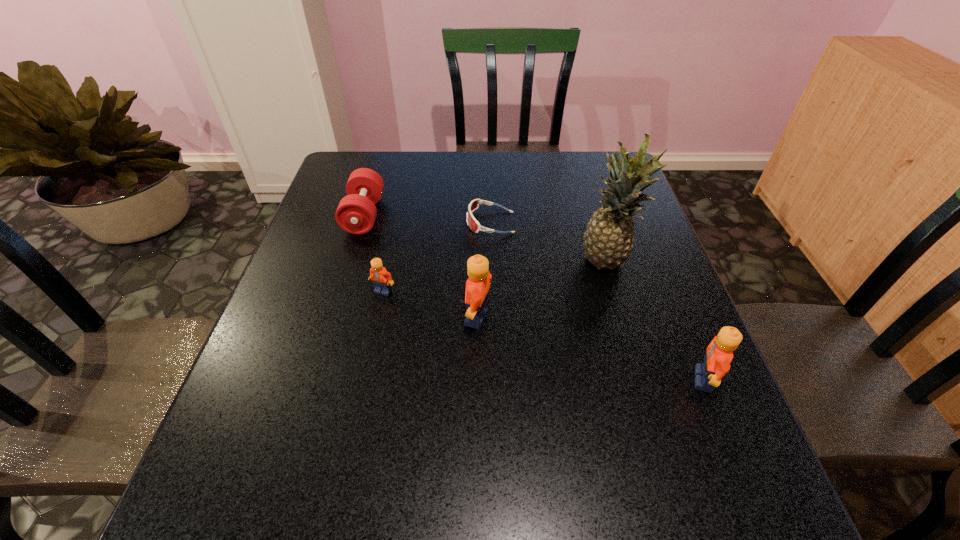
Where is `free point between the fourth farthest object and the rightmost Lego`? The width and height of the screenshot is (960, 540). free point between the fourth farthest object and the rightmost Lego is located at coordinates (543, 335).

This screenshot has height=540, width=960. Identify the location of vacant space in between the leftmost object and the fifth object from left to right. (486, 238).

Find the location of a particular element. The height and width of the screenshot is (540, 960). vacant point located between the second object from right to left and the goggles is located at coordinates (549, 242).

The width and height of the screenshot is (960, 540). I want to click on free point between the third tallest object and the leftmost object, so click(534, 298).

At what (x,y) coordinates should I click in order to perform the action: click on vacant region between the tallest object and the second farthest Lego. Please return your answer as a coordinate pair (x, y). Looking at the image, I should click on (542, 289).

Identify the location of empty location between the shortest Lego and the shortest object. (437, 257).

Where is `free space that is in between the dumbbell and the nearest object`? The height and width of the screenshot is (540, 960). free space that is in between the dumbbell and the nearest object is located at coordinates (534, 298).

Locate an element on the screen. The width and height of the screenshot is (960, 540). vacant area that lies between the fourth shortest object and the fifth object from right to left is located at coordinates (543, 335).

The height and width of the screenshot is (540, 960). What are the coordinates of `free space between the goggles and the dumbbell` in the screenshot? It's located at (427, 219).

Point out which object is positioned as the second nearest to the dumbbell. Please provide its 2D coordinates. Your answer should be formatted as a tuple, i.e. [(x, y)], where the tuple contains the x and y coordinates of a point satisfying the conditions above.

[(474, 225)]